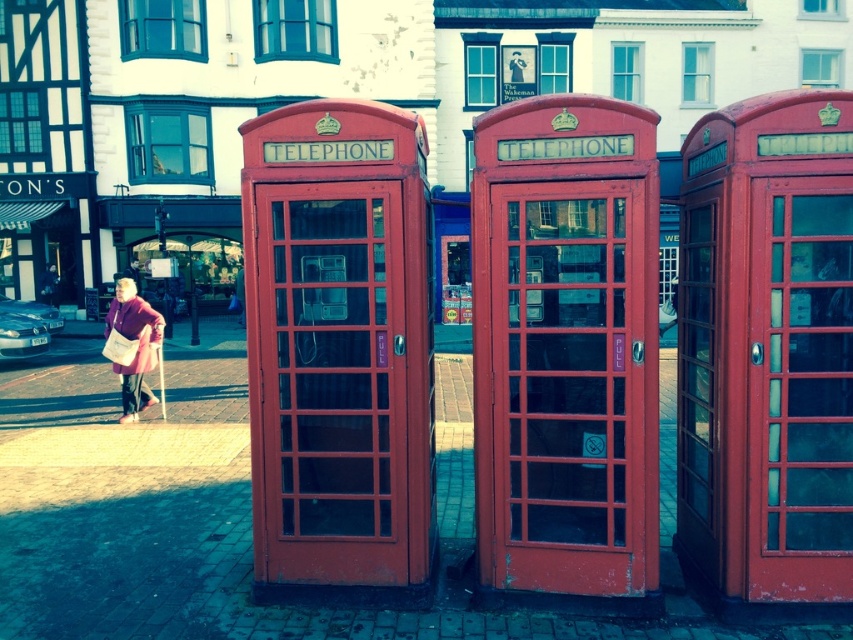
Between matte purple coat at lower left and light brown leather jacket at center, which one has more height?

matte purple coat at lower left is taller.

Is matte purple coat at lower left closer to camera compared to light brown leather jacket at center?

That is True.

Is point (137, 410) positioned after point (242, 276)?

No, it is in front of (242, 276).

Locate an element on the screen. matte purple coat at lower left is located at coordinates (132, 342).